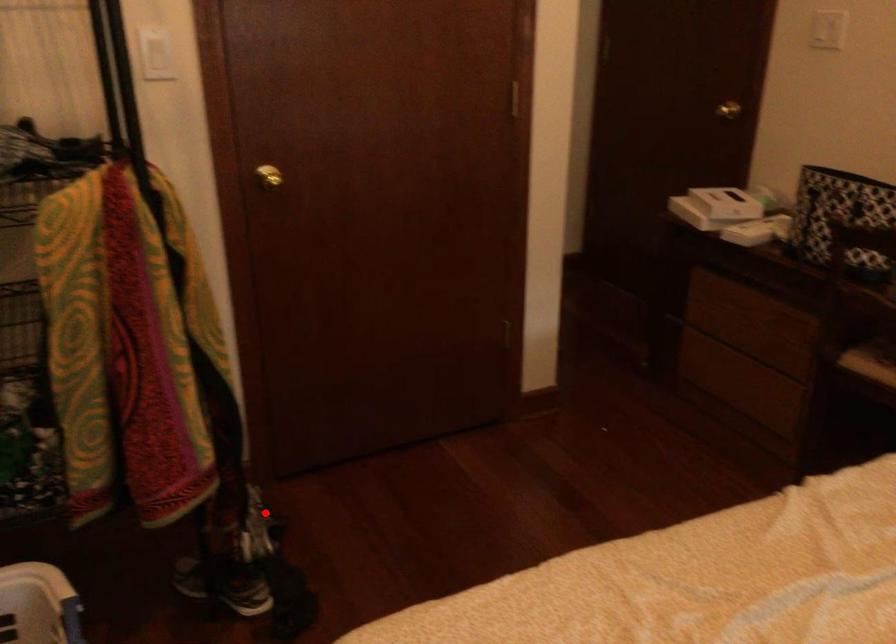
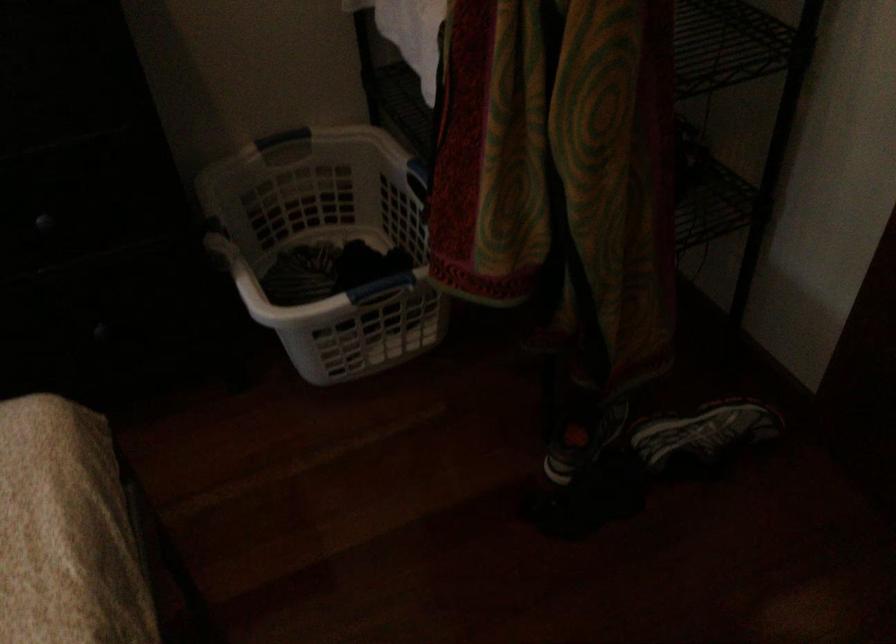
Question: A red point is marked in image1. In image2, is the corresponding 3D point closer to the camera or farther? Reply with the corresponding letter.

Choices:
 (A) The corresponding 3D point is closer.
 (B) The corresponding 3D point is farther.

Answer: (A)